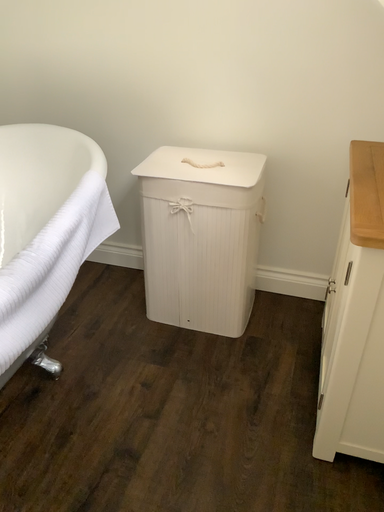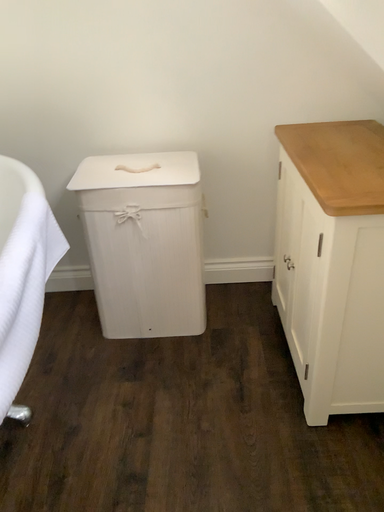
Question: How did the camera likely rotate when shooting the video?

Choices:
 (A) rotated right
 (B) rotated left

Answer: (A)